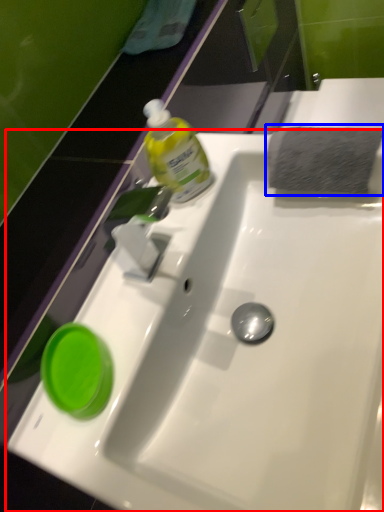
Question: Which object appears farthest to the camera in this image, sink (highlighted by a red box) or hand towel (highlighted by a blue box)?

Choices:
 (A) sink
 (B) hand towel

Answer: (B)